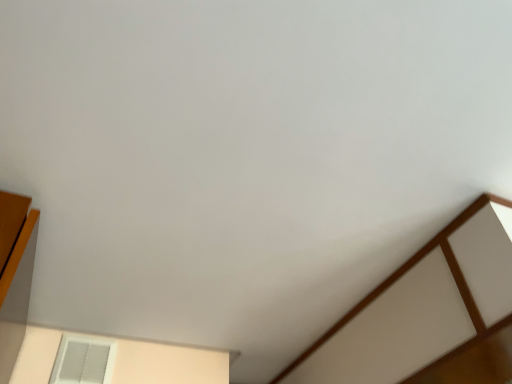
Question: From a real-world perspective, is white textured window at lower left above or below wooden paneling at right?

Choices:
 (A) below
 (B) above

Answer: (B)

Question: Is white textured window at lower left inside or outside of wooden paneling at right?

Choices:
 (A) outside
 (B) inside

Answer: (A)

Question: Considering the positions of point (76, 354) and point (384, 362), is point (76, 354) closer or farther from the camera than point (384, 362)?

Choices:
 (A) closer
 (B) farther

Answer: (B)

Question: Based on their positions, is wooden paneling at right located to the left or right of white textured window at lower left?

Choices:
 (A) left
 (B) right

Answer: (B)

Question: In terms of width, does wooden paneling at right look wider or thinner when compared to white textured window at lower left?

Choices:
 (A) thin
 (B) wide

Answer: (B)

Question: Is wooden paneling at right inside or outside of white textured window at lower left?

Choices:
 (A) inside
 (B) outside

Answer: (B)

Question: Is point coord(435,258) closer or farther from the camera than point coord(99,339)?

Choices:
 (A) farther
 (B) closer

Answer: (B)